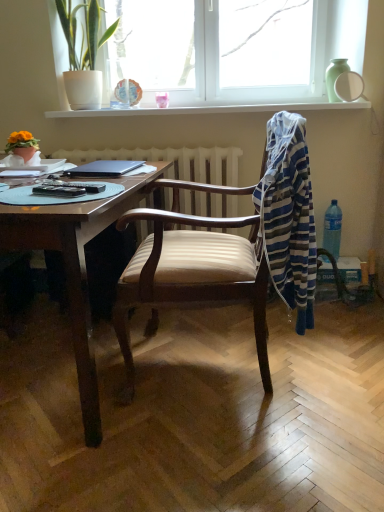
Question: Considering the relative sizes of green leafy plant at upper left, the second houseplant positioned from the front, and white glossy shelf at upper center in the image provided, is green leafy plant at upper left, the second houseplant positioned from the front, wider than white glossy shelf at upper center?

Choices:
 (A) no
 (B) yes

Answer: (A)

Question: From the image's perspective, is green leafy plant at upper left, the second houseplant positioned from the front, below white glossy shelf at upper center?

Choices:
 (A) no
 (B) yes

Answer: (A)

Question: From a real-world perspective, does green leafy plant at upper left, the second houseplant positioned from the front, stand above white glossy shelf at upper center?

Choices:
 (A) no
 (B) yes

Answer: (B)

Question: Is green leafy plant at upper left, which is counted as the 1th houseplant, starting from the right, surrounding white glossy shelf at upper center?

Choices:
 (A) no
 (B) yes

Answer: (A)

Question: Is green leafy plant at upper left, placed as the 2th houseplant when sorted from left to right, at the right side of white glossy shelf at upper center?

Choices:
 (A) yes
 (B) no

Answer: (B)

Question: Considering the relative sizes of green leafy plant at upper left, placed as the 2th houseplant when sorted from left to right, and white glossy shelf at upper center in the image provided, is green leafy plant at upper left, placed as the 2th houseplant when sorted from left to right, smaller than white glossy shelf at upper center?

Choices:
 (A) yes
 (B) no

Answer: (B)

Question: From the image's perspective, is black plastic remote control at table left over clear plastic bottle at right?

Choices:
 (A) no
 (B) yes

Answer: (B)

Question: Is black plastic remote control at table left wider than clear plastic bottle at right?

Choices:
 (A) yes
 (B) no

Answer: (B)

Question: Could you tell me if black plastic remote control at table left is turned towards clear plastic bottle at right?

Choices:
 (A) no
 (B) yes

Answer: (A)

Question: From a real-world perspective, is black plastic remote control at table left positioned under clear plastic bottle at right based on gravity?

Choices:
 (A) yes
 (B) no

Answer: (B)

Question: Is black plastic remote control at table left looking in the opposite direction of clear plastic bottle at right?

Choices:
 (A) no
 (B) yes

Answer: (A)

Question: From the image's perspective, would you say black plastic remote control at table left is shown under clear plastic bottle at right?

Choices:
 (A) yes
 (B) no

Answer: (B)

Question: Is white glass window at upper center to the left of white glossy mirror at upper right from the viewer's perspective?

Choices:
 (A) no
 (B) yes

Answer: (B)